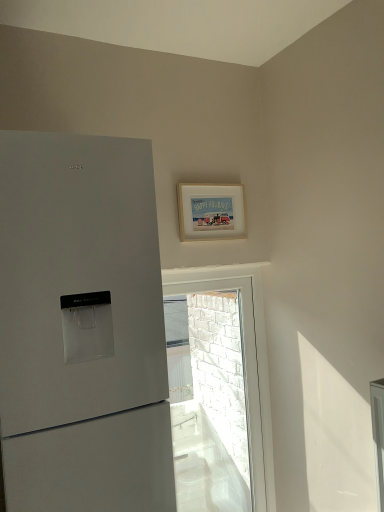
Question: Does white brick wall at upper center have a smaller size compared to white matte picture frame at upper center?

Choices:
 (A) yes
 (B) no

Answer: (B)

Question: Is white brick wall at upper center looking in the opposite direction of white matte picture frame at upper center?

Choices:
 (A) no
 (B) yes

Answer: (A)

Question: From the image's perspective, does white brick wall at upper center appear lower than white matte picture frame at upper center?

Choices:
 (A) yes
 (B) no

Answer: (A)

Question: From a real-world perspective, does white brick wall at upper center stand above white matte picture frame at upper center?

Choices:
 (A) yes
 (B) no

Answer: (B)

Question: Is white brick wall at upper center next to white matte picture frame at upper center and touching it?

Choices:
 (A) yes
 (B) no

Answer: (B)

Question: Is white brick wall at upper center thinner than white matte picture frame at upper center?

Choices:
 (A) no
 (B) yes

Answer: (A)

Question: Is white matte picture frame at upper center smaller than white brick wall at upper center?

Choices:
 (A) no
 (B) yes

Answer: (B)

Question: Can we say white matte picture frame at upper center lies outside white brick wall at upper center?

Choices:
 (A) no
 (B) yes

Answer: (B)

Question: From a real-world perspective, is white matte picture frame at upper center beneath white brick wall at upper center?

Choices:
 (A) yes
 (B) no

Answer: (B)

Question: Is white matte picture frame at upper center thinner than white brick wall at upper center?

Choices:
 (A) yes
 (B) no

Answer: (A)

Question: Considering the relative positions of white matte picture frame at upper center and white brick wall at upper center in the image provided, is white matte picture frame at upper center to the right of white brick wall at upper center from the viewer's perspective?

Choices:
 (A) yes
 (B) no

Answer: (B)

Question: Could you tell me if white matte picture frame at upper center is turned towards white brick wall at upper center?

Choices:
 (A) yes
 (B) no

Answer: (B)

Question: Is white matte picture frame at upper center in front of or behind white brick wall at upper center in the image?

Choices:
 (A) front
 (B) behind

Answer: (A)